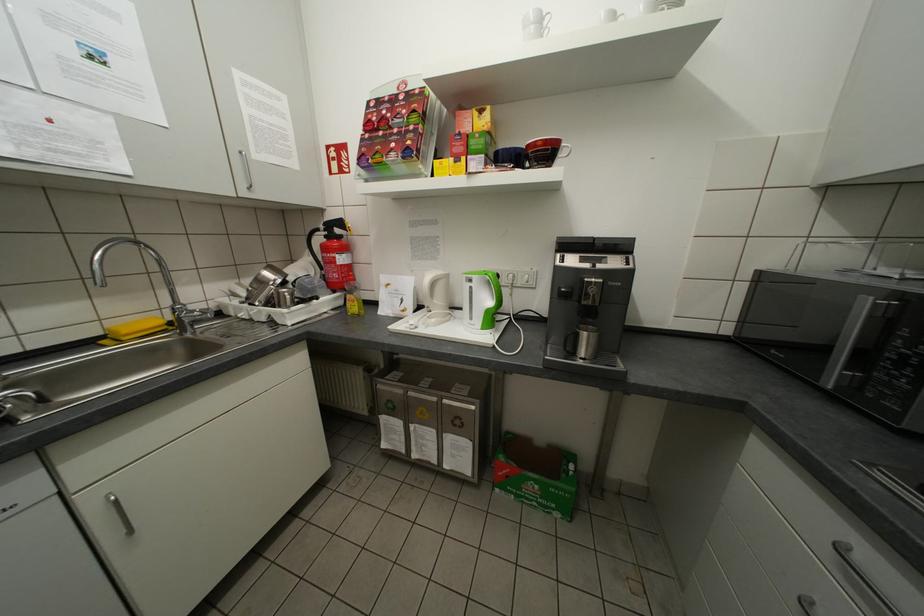
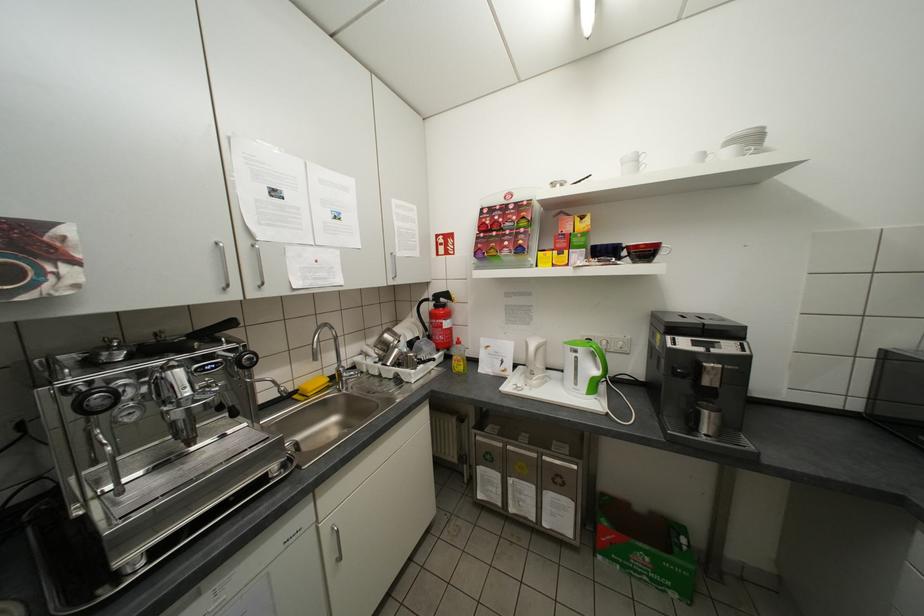
Where in the second image is the point corresponding to (x=132, y=331) from the first image?

(319, 389)